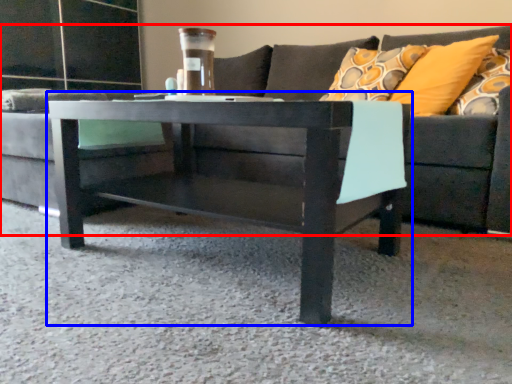
Question: Which object appears farthest to the camera in this image, studio couch (highlighted by a red box) or coffee table (highlighted by a blue box)?

Choices:
 (A) studio couch
 (B) coffee table

Answer: (B)